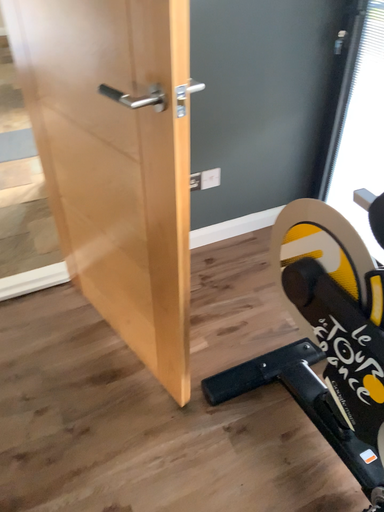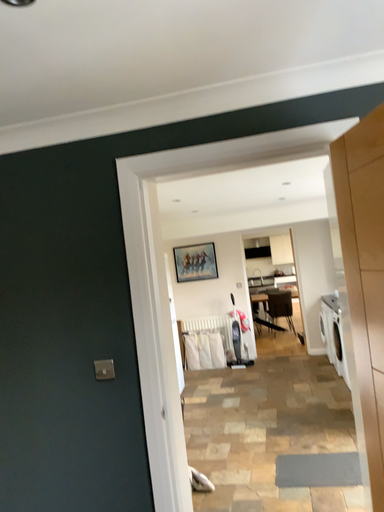
Question: How did the camera likely rotate when shooting the video?

Choices:
 (A) rotated left
 (B) rotated right

Answer: (A)